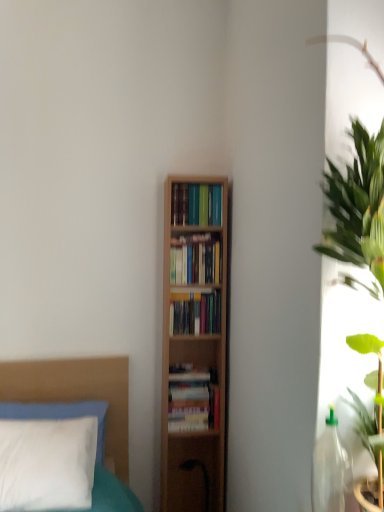
Question: Is hardcover books at center, the 3th book when ordered from top to bottom, not inside hardcover books at center, which is the 1th book in top-to-bottom order?

Choices:
 (A) no
 (B) yes

Answer: (B)

Question: From the image's perspective, does hardcover books at center, which appears as the 2th book when ordered from the bottom, appear higher than hardcover books at center, which is the 1th book in top-to-bottom order?

Choices:
 (A) yes
 (B) no

Answer: (B)

Question: Can you confirm if hardcover books at center, which appears as the 2th book when ordered from the bottom, is thinner than hardcover books at center, acting as the 4th book starting from the bottom?

Choices:
 (A) no
 (B) yes

Answer: (B)

Question: Is hardcover books at center, which is the 1th book in top-to-bottom order, located within hardcover books at center, the 3th book when ordered from top to bottom?

Choices:
 (A) yes
 (B) no

Answer: (B)

Question: Is hardcover books at center, the 3th book when ordered from top to bottom, positioned with its back to hardcover books at center, which is the 1th book in top-to-bottom order?

Choices:
 (A) no
 (B) yes

Answer: (A)

Question: From the image's perspective, is hardcover books at center, the 3th book when ordered from top to bottom, under hardcover books at center, which is the 1th book in top-to-bottom order?

Choices:
 (A) no
 (B) yes

Answer: (B)

Question: Is wooden bookshelf at center, marked as the second book in a top-to-bottom arrangement, outside of hardcover books at center, the 3th book when ordered from top to bottom?

Choices:
 (A) no
 (B) yes

Answer: (B)

Question: Considering the relative sizes of wooden bookshelf at center, marked as the second book in a top-to-bottom arrangement, and hardcover books at center, the 3th book when ordered from top to bottom, in the image provided, is wooden bookshelf at center, marked as the second book in a top-to-bottom arrangement, bigger than hardcover books at center, the 3th book when ordered from top to bottom,?

Choices:
 (A) yes
 (B) no

Answer: (A)

Question: Does wooden bookshelf at center, marked as the 3th book in a bottom-to-top arrangement, have a smaller size compared to hardcover books at center, which appears as the 2th book when ordered from the bottom?

Choices:
 (A) yes
 (B) no

Answer: (B)

Question: From the image's perspective, does wooden bookshelf at center, marked as the second book in a top-to-bottom arrangement, appear lower than hardcover books at center, which appears as the 2th book when ordered from the bottom?

Choices:
 (A) yes
 (B) no

Answer: (B)

Question: Can you confirm if wooden bookshelf at center, marked as the 3th book in a bottom-to-top arrangement, is positioned to the right of hardcover books at center, which appears as the 2th book when ordered from the bottom?

Choices:
 (A) no
 (B) yes

Answer: (B)

Question: Could you tell me if wooden bookshelf at center, marked as the second book in a top-to-bottom arrangement, is turned towards hardcover books at center, the 3th book when ordered from top to bottom?

Choices:
 (A) yes
 (B) no

Answer: (B)

Question: Is hardcover books at center, which appears as the 2th book when ordered from the bottom, completely or partially inside hardcover books at center, which is the 4th book from top to bottom?

Choices:
 (A) yes
 (B) no

Answer: (B)